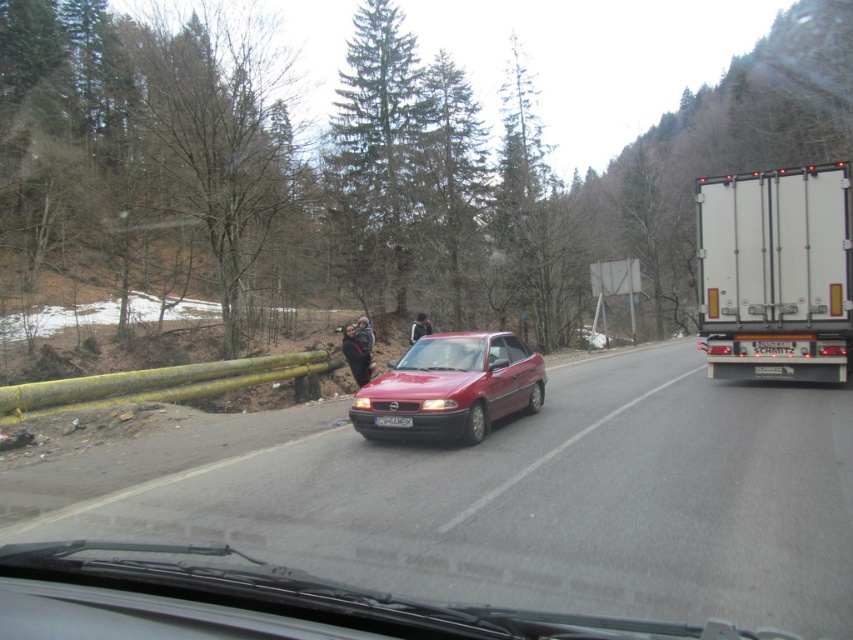
Question: Which point is farther from the camera taking this photo?

Choices:
 (A) (796, 365)
 (B) (45, 477)
 (C) (532, 403)

Answer: (A)

Question: Estimate the real-world distances between objects in this image. Which object is closer to the black plastic license plate at center?

Choices:
 (A) white matte truck at right
 (B) smooth asphalt road at center

Answer: (A)

Question: Can you confirm if smooth asphalt road at center is positioned to the left of white matte truck at right?

Choices:
 (A) no
 (B) yes

Answer: (B)

Question: Is white matte truck at right closer to camera compared to white plastic license plate at center?

Choices:
 (A) no
 (B) yes

Answer: (A)

Question: Is matte red car at center behind black plastic license plate at center?

Choices:
 (A) yes
 (B) no

Answer: (B)

Question: Based on their relative distances, which object is nearer to the white matte truck at right?

Choices:
 (A) matte red car at center
 (B) dark brown leather jacket at center
 (C) white plastic license plate at center

Answer: (B)